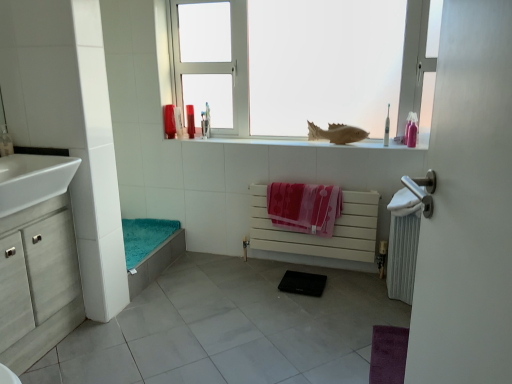
Question: Does white metallic radiator at right, which is counted as the 1th radiator, starting from the right, have a smaller size compared to white glossy sink at left?

Choices:
 (A) yes
 (B) no

Answer: (A)

Question: Is white glossy sink at left located within white metallic radiator at right, acting as the second radiator starting from the left?

Choices:
 (A) no
 (B) yes

Answer: (A)

Question: Does white metallic radiator at right, which is counted as the 1th radiator, starting from the right, touch white glossy sink at left?

Choices:
 (A) no
 (B) yes

Answer: (A)

Question: Can you confirm if white metallic radiator at right, which is counted as the 1th radiator, starting from the right, is bigger than white glossy sink at left?

Choices:
 (A) yes
 (B) no

Answer: (B)

Question: Does white metallic radiator at right, acting as the second radiator starting from the left, come behind white glossy sink at left?

Choices:
 (A) no
 (B) yes

Answer: (B)

Question: Considering the positions of point (330, 221) and point (412, 124), is point (330, 221) closer or farther from the camera than point (412, 124)?

Choices:
 (A) closer
 (B) farther

Answer: (B)

Question: From the image's perspective, is pink fabric beach towel at center above or below pink matte bottle at upper right, arranged as the first toiletry when viewed from the right?

Choices:
 (A) below
 (B) above

Answer: (A)

Question: Is pink fabric beach towel at center wider or thinner than pink matte bottle at upper right, placed as the 2th toiletry when sorted from front to back?

Choices:
 (A) wide
 (B) thin

Answer: (A)

Question: Is pink fabric beach towel at center situated inside pink matte bottle at upper right, placed as the 2th toiletry when sorted from front to back, or outside?

Choices:
 (A) outside
 (B) inside

Answer: (A)

Question: Does point (180, 115) appear closer or farther from the camera than point (263, 317)?

Choices:
 (A) farther
 (B) closer

Answer: (A)

Question: From a real-world perspective, is translucent plastic cup at upper center, the fourth toiletry positioned from the right, above or below gray tile at center?

Choices:
 (A) below
 (B) above

Answer: (B)

Question: Based on their sizes in the image, would you say translucent plastic cup at upper center, placed as the third toiletry when sorted from left to right, is bigger or smaller than gray tile at center?

Choices:
 (A) small
 (B) big

Answer: (A)

Question: Relative to gray tile at center, is translucent plastic cup at upper center, which is counted as the third toiletry, starting from the back, in front or behind?

Choices:
 (A) behind
 (B) front

Answer: (A)

Question: Considering the relative positions of matte brown fish at upper center and pink matte bottle at upper right, arranged as the fifth toiletry when viewed from the back, in the image provided, is matte brown fish at upper center to the left or to the right of pink matte bottle at upper right, arranged as the fifth toiletry when viewed from the back,?

Choices:
 (A) left
 (B) right

Answer: (A)

Question: Considering the positions of matte brown fish at upper center and pink matte bottle at upper right, arranged as the fifth toiletry when viewed from the back, in the image, is matte brown fish at upper center taller or shorter than pink matte bottle at upper right, arranged as the fifth toiletry when viewed from the back,?

Choices:
 (A) tall
 (B) short

Answer: (B)